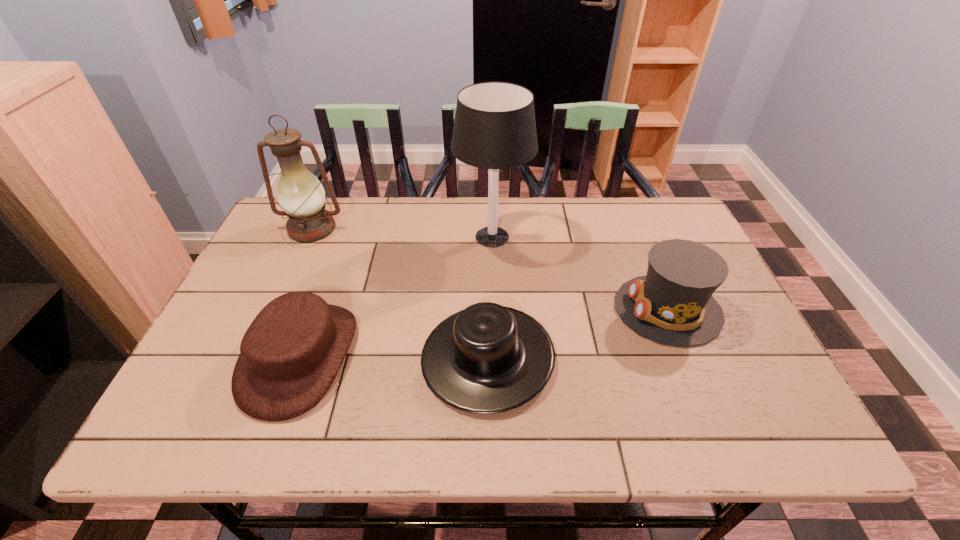
You are a GUI agent. You are given a task and a screenshot of the screen. Output one action in this format:
    pyautogui.click(x=<x>, y=<y>)
    Task: Click on the unoccupied area between the second hat from right to left and the leftmost hat
    
    Given the screenshot: What is the action you would take?
    pyautogui.click(x=394, y=357)

What are the coordinates of `free space between the third tallest object and the second hat from right to left` in the screenshot? It's located at (578, 333).

The image size is (960, 540). In order to click on the third closest object relative to the table lamp in this screenshot , I will do `click(291, 353)`.

Locate an element on the screen. This screenshot has width=960, height=540. the second closest object to the second hat from right to left is located at coordinates (673, 304).

I want to click on hat that is the closest one to the leftmost hat, so click(x=485, y=359).

Image resolution: width=960 pixels, height=540 pixels. In order to click on hat that stands as the closest to the rightmost object in this screenshot , I will do `click(485, 359)`.

This screenshot has width=960, height=540. In order to click on blank area in the image that satisfies the following two spatial constraints: 1. on the front side of the leftmost hat; 2. on the right side of the oil lamp in this screenshot , I will do `click(255, 357)`.